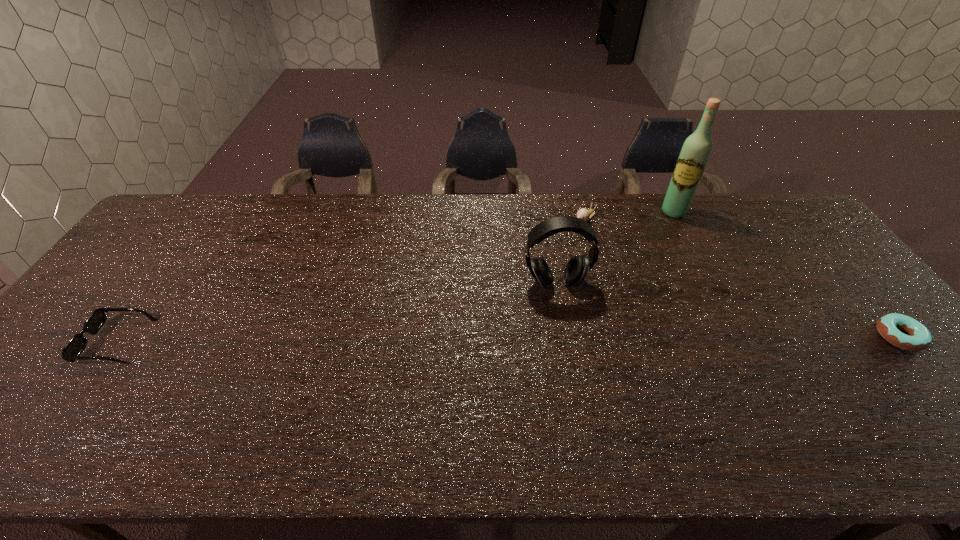
Where is `vacant area situated 0.120m on the front of the doughnut`? The width and height of the screenshot is (960, 540). vacant area situated 0.120m on the front of the doughnut is located at coordinates (949, 397).

This screenshot has width=960, height=540. I want to click on vacant space located 0.250m on the ear cups of the earphone, so click(x=580, y=370).

The width and height of the screenshot is (960, 540). I want to click on vacant position located on the ear cups of the earphone, so click(x=588, y=400).

This screenshot has height=540, width=960. Identify the location of vacant space located 0.330m on the ear cups of the earphone. (588, 400).

In order to click on vacant area situated 0.300m on the shell of the escargot in this screenshot , I will do `click(527, 274)`.

You are a GUI agent. You are given a task and a screenshot of the screen. Output one action in this format:
    pyautogui.click(x=<x>, y=<y>)
    Task: Click on the vacant space located 0.190m on the shell of the escargot
    The width and height of the screenshot is (960, 540).
    Given the screenshot: What is the action you would take?
    pyautogui.click(x=547, y=255)

The width and height of the screenshot is (960, 540). Identify the location of free spot located on the shell of the escargot. (529, 273).

In order to click on free space located on the front-facing side of the tallest object in this screenshot , I will do `click(659, 243)`.

You are a GUI agent. You are given a task and a screenshot of the screen. Output one action in this format:
    pyautogui.click(x=<x>, y=<y>)
    Task: Click on the free space located on the front-facing side of the tallest object
    This screenshot has width=960, height=540.
    Given the screenshot: What is the action you would take?
    pyautogui.click(x=640, y=279)

The image size is (960, 540). Identify the location of vacant space positioned 0.370m on the front-facing side of the tallest object. (637, 286).